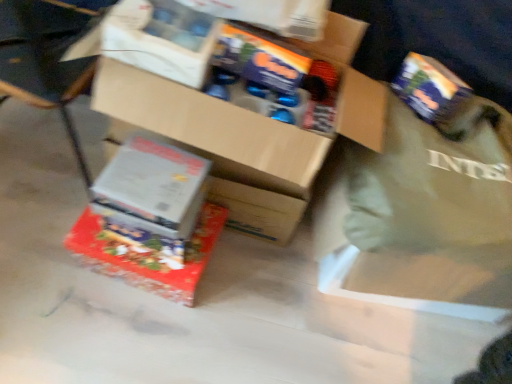
Find the location of a particular element. The height and width of the screenshot is (384, 512). vacant space underneath wooden chair at lower left (from a real-world perspective) is located at coordinates 58,151.